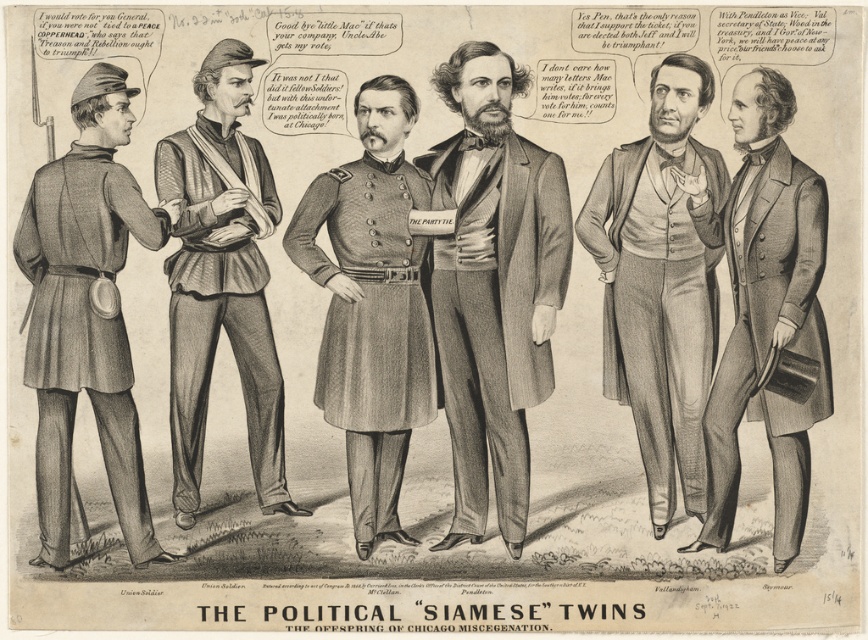
In the political cartoon depicting six figures, there is a rustic leather vest at center and a gray wool military coat at center. Which of these two items is bigger in size?

The rustic leather vest at center is larger in size than the gray wool military coat at center.

Based on the political cartoon scene, which object is positioned lower between the smooth gray coat at center and the rustic leather vest at center?

The smooth gray coat at center is positioned lower than the rustic leather vest at center according to the description.

Based on the political cartoon scene, which object is positioned behind the other between the smooth gray vest at center and the smooth gray coat at center?

The smooth gray coat at center is positioned behind the smooth gray vest at center.